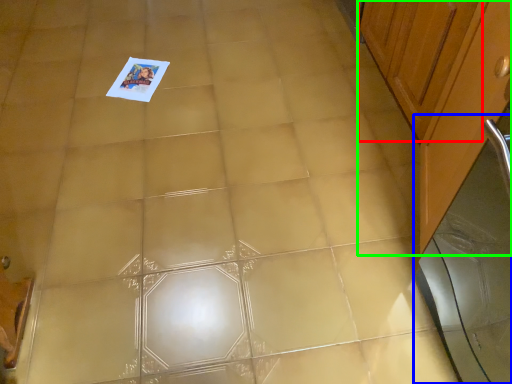
Question: Which is nearer to the cabinetry (highlighted by a red box)? screen door (highlighted by a blue box) or cabinetry (highlighted by a green box).

Choices:
 (A) screen door
 (B) cabinetry

Answer: (B)